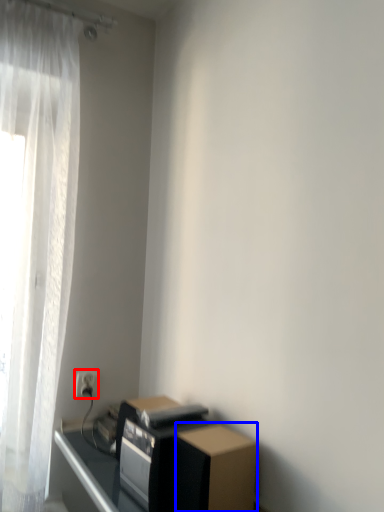
Question: Which object appears closest to the camera in this image, electric outlet (highlighted by a red box) or cardboard box (highlighted by a blue box)?

Choices:
 (A) electric outlet
 (B) cardboard box

Answer: (B)